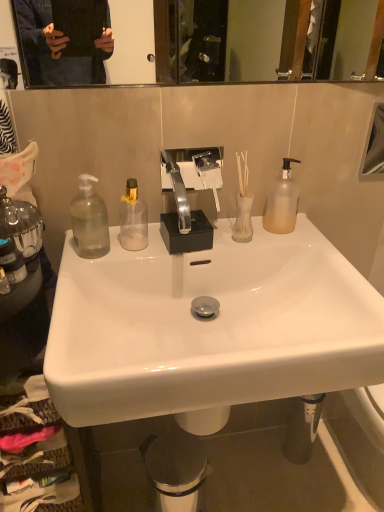
Find the location of a particular element. vacant area in front of frosted glass pump bottle at right, the first bottle from the right is located at coordinates (301, 247).